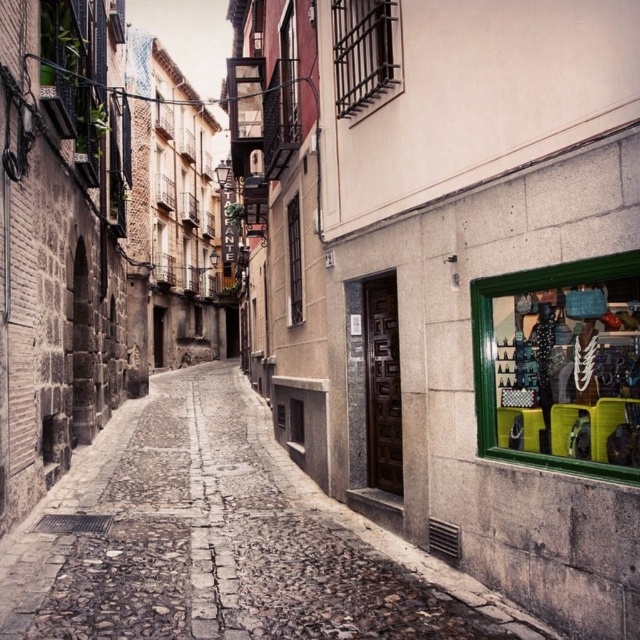
Question: Can you confirm if cobblestone at center is thinner than green plastic baskets at right?

Choices:
 (A) yes
 (B) no

Answer: (B)

Question: Which point is farther to the camera?

Choices:
 (A) green plastic baskets at right
 (B) cobblestone at center

Answer: (B)

Question: Which point is farther to the camera?

Choices:
 (A) green plastic baskets at right
 (B) cobblestone at center

Answer: (B)

Question: Can you confirm if cobblestone at center is wider than green plastic baskets at right?

Choices:
 (A) yes
 (B) no

Answer: (A)

Question: Can you confirm if cobblestone at center is positioned below green plastic baskets at right?

Choices:
 (A) no
 (B) yes

Answer: (B)